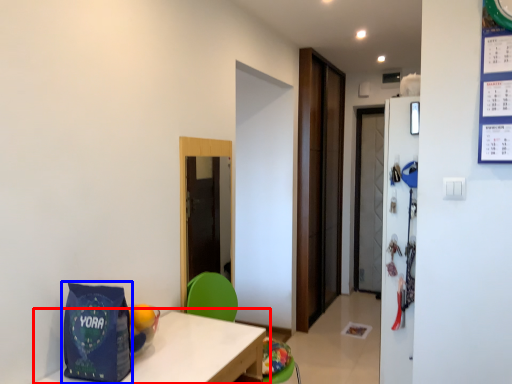
Question: Which of the following is the closest to the observer, table (highlighted by a red box) or gift bag (highlighted by a blue box)?

Choices:
 (A) table
 (B) gift bag

Answer: (A)